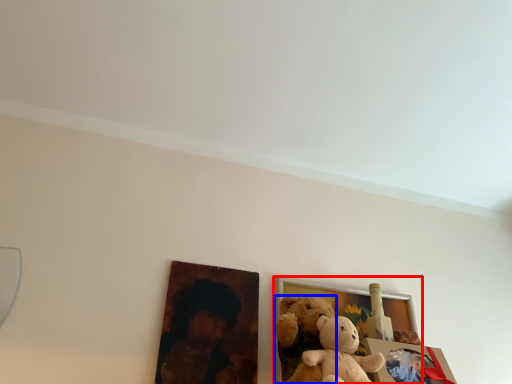
Question: Which object appears farthest to the camera in this image, picture frame (highlighted by a red box) or teddy bear (highlighted by a blue box)?

Choices:
 (A) picture frame
 (B) teddy bear

Answer: (A)